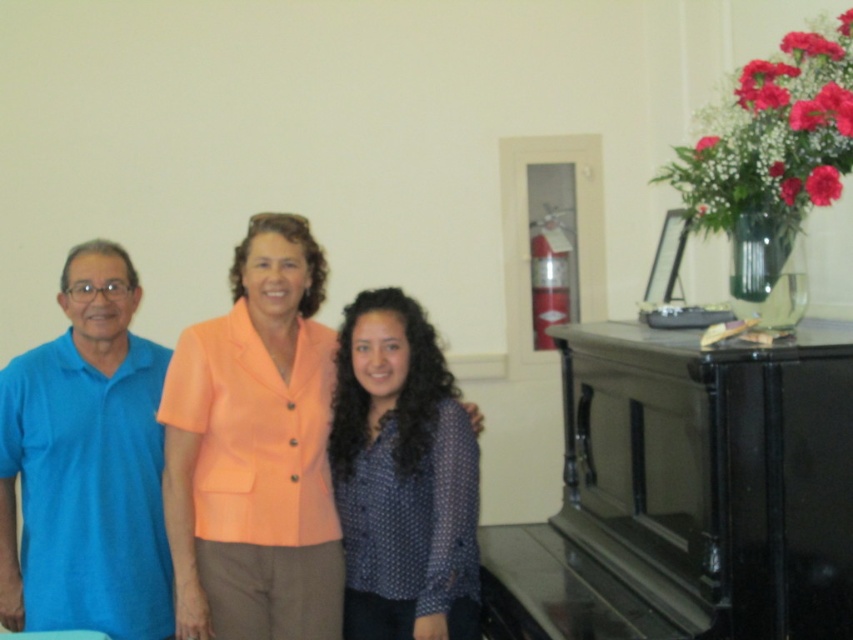
Question: Among these points, which one is nearest to the camera?

Choices:
 (A) coord(316,612)
 (B) coord(247,276)
 (C) coord(717,408)

Answer: (C)

Question: Considering the relative positions of black polished piano at right and blue cotton shirt at left in the image provided, where is black polished piano at right located with respect to blue cotton shirt at left?

Choices:
 (A) right
 (B) left

Answer: (A)

Question: Does blue cotton polo shirt at left have a greater width compared to blue dotted shirt at center?

Choices:
 (A) yes
 (B) no

Answer: (A)

Question: Which object is farther from the camera taking this photo?

Choices:
 (A) blue cotton shirt at left
 (B) black polished piano at right
 (C) blue cotton polo shirt at left

Answer: (C)

Question: Which object is closer to the camera taking this photo?

Choices:
 (A) blue dotted shirt at center
 (B) blue cotton polo shirt at left
 (C) black polished piano at right
 (D) blue cotton shirt at left

Answer: (C)

Question: Is black polished piano at right to the right of blue cotton shirt at left from the viewer's perspective?

Choices:
 (A) yes
 (B) no

Answer: (A)